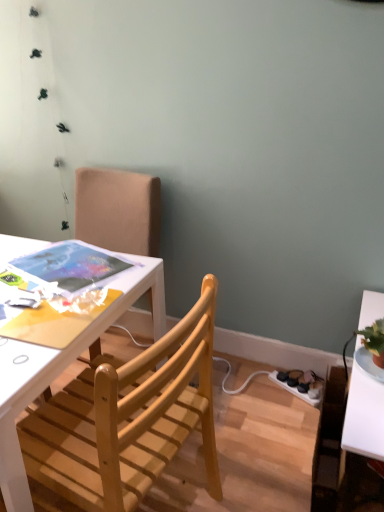
Question: Considering the positions of point (208, 395) and point (306, 397), is point (208, 395) closer or farther from the camera than point (306, 397)?

Choices:
 (A) closer
 (B) farther

Answer: (A)

Question: In terms of size, does light wood chair at center, which is the 1th chair in front-to-back order, appear bigger or smaller than white plastic power outlet at lower right?

Choices:
 (A) small
 (B) big

Answer: (B)

Question: Based on their relative distances, which object is farther from the light wood chair at center, arranged as the second chair when viewed from the back?

Choices:
 (A) white plastic power outlet at lower right
 (B) wooden chair at upper left, which is counted as the first chair, starting from the back

Answer: (A)

Question: Which of these objects is positioned closest to the white plastic power outlet at lower right?

Choices:
 (A) light wood chair at center, arranged as the second chair when viewed from the back
 (B) wooden chair at upper left, which is counted as the first chair, starting from the back

Answer: (A)